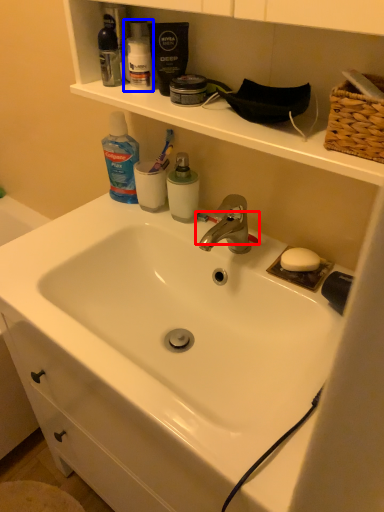
Question: Which object appears closest to the camera in this image, toothbrush (highlighted by a red box) or toiletry (highlighted by a blue box)?

Choices:
 (A) toothbrush
 (B) toiletry

Answer: (B)